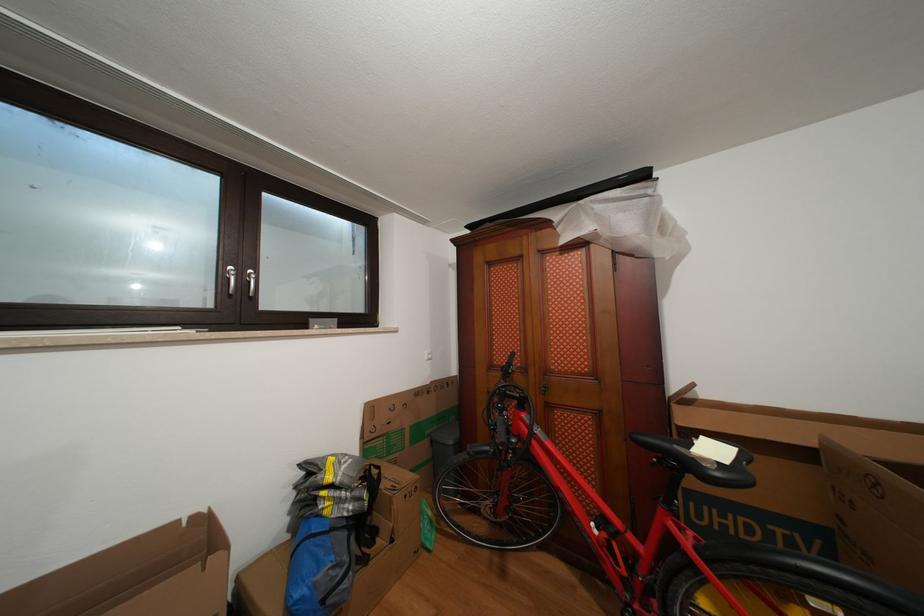
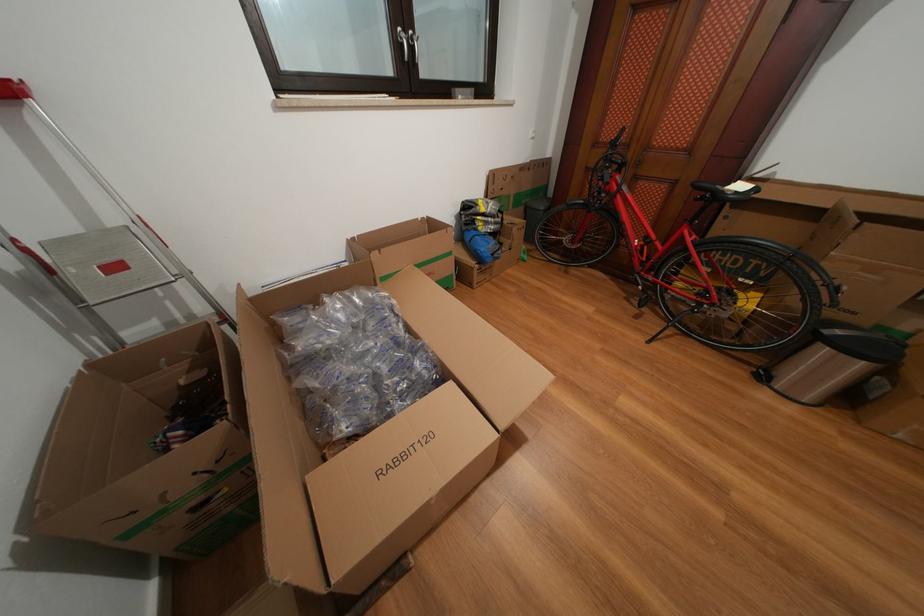
Where in the second image is the point corresponding to point (721, 456) from the first image?

(747, 192)